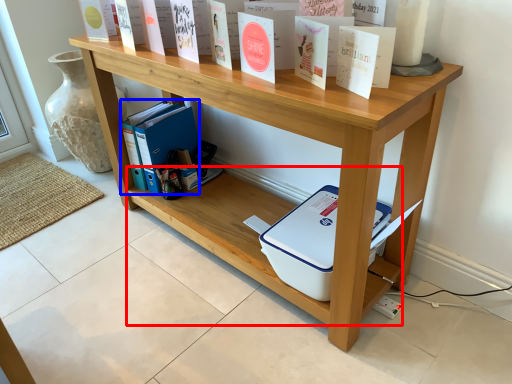
Question: Which of the following is the closest to the observer, shelf (highlighted by a red box) or book (highlighted by a blue box)?

Choices:
 (A) shelf
 (B) book

Answer: (A)